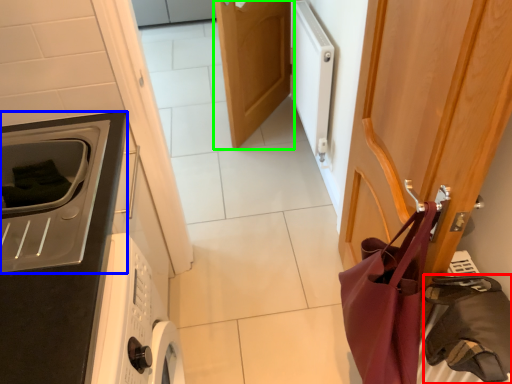
Question: Which is farther away from bag (highlighted by a red box)? home appliance (highlighted by a blue box) or door (highlighted by a green box)?

Choices:
 (A) home appliance
 (B) door

Answer: (B)